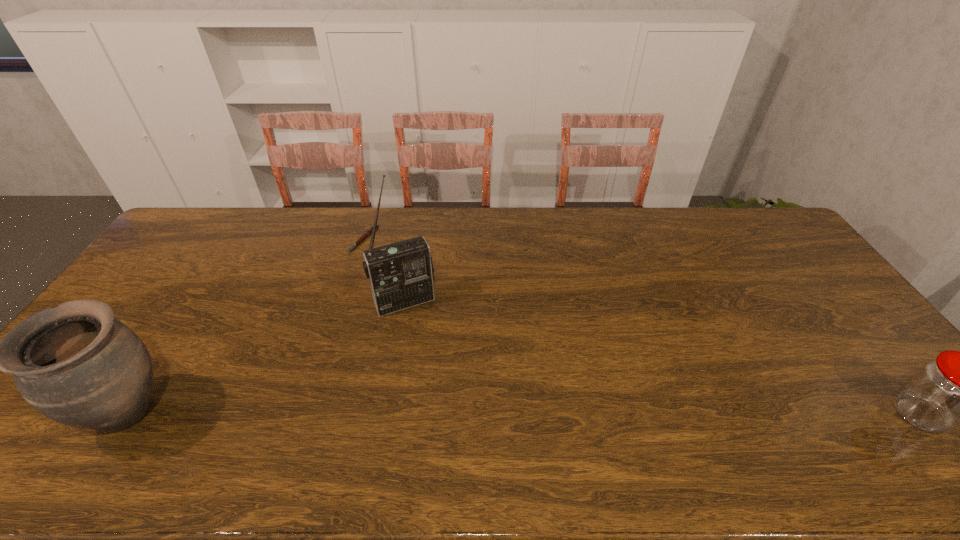
Identify the location of vacant space on the desktop that is between the urn and the second shortest object and is positioned at the nib of the third object from right to left. This screenshot has height=540, width=960. (486, 413).

Where is `vacant space on the desktop that is between the leftmost object and the jar and is positioned on the display of the radio receiver`? The width and height of the screenshot is (960, 540). vacant space on the desktop that is between the leftmost object and the jar and is positioned on the display of the radio receiver is located at coordinates (455, 413).